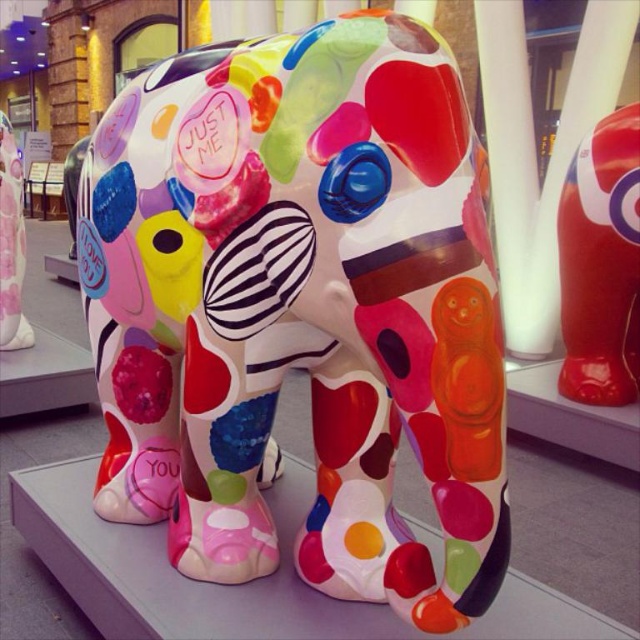
You are an interior designer planning to place a new lamp next to the shiny red elephant at center and the white glossy pillar at center. Which object should the lamp be placed closer to if you want it to appear proportionally balanced with their heights?

The lamp should be placed closer to the shiny red elephant at center because it is shorter than the white glossy pillar at center, so balancing their heights would require the lamp to be nearer to the shorter object.

You are standing in the exhibition hall and want to take a photo of the multicolored glossy elephant at center. If you are currently at the entrance located at point 0.0, 0.0, which direction should you move to face the elephant?

Since the multicolored glossy elephant at center is located at point (300, 308), you should move towards the northeast direction to face it from the entrance at (0, 0).

From the picture: You are an art curator planning to install a new sculpture in the exhibition hall. The space between the multicolored glossy elephant at center and the shiny red elephant at center must accommodate a 2.5 meter wide sculpture. Is there enough space for it?

The distance between the multicolored glossy elephant at center and the shiny red elephant at center is 2.42 meters, which is slightly less than the required 2.5 meters. Therefore, there is not enough space to fit the 2.5 meter wide sculpture between them.